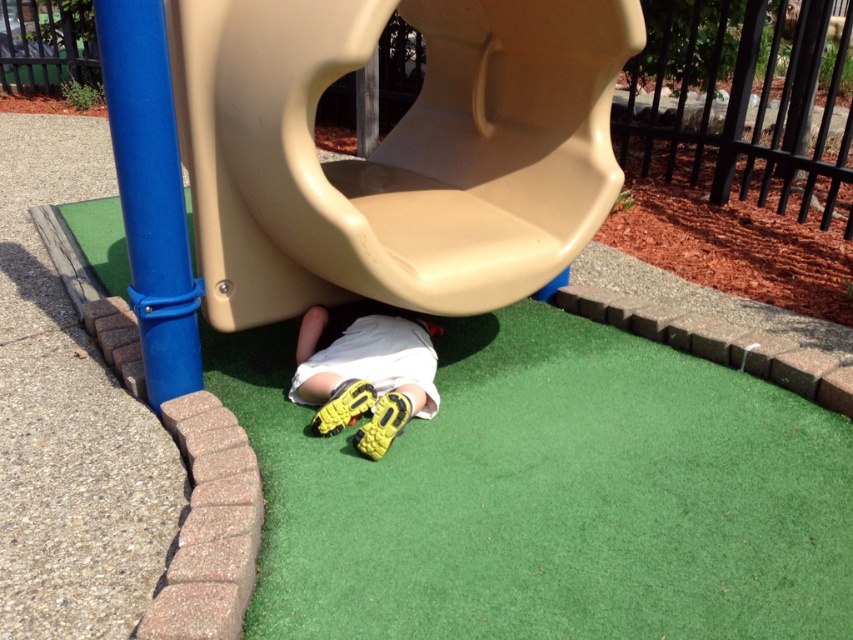
You are a parent looking for a safe spot to place your child. The green artificial turf at lower center and the tan plastic slide at center are both in view. Which surface is better for a soft landing if the child might fall?

The green artificial turf at lower center is better for a soft landing because it is a surface designed for cushioning falls, unlike the tan plastic slide at center which is hard.

You are a parent trying to find a place to sit while watching your child play. The green artificial turf at lower center and the tan plastic slide at center are both in sight. Which surface would you choose if you prefer a softer spot to sit?

The green artificial turf at lower center is softer than the tan plastic slide at center because artificial turf is typically softer than hard plastic surfaces.